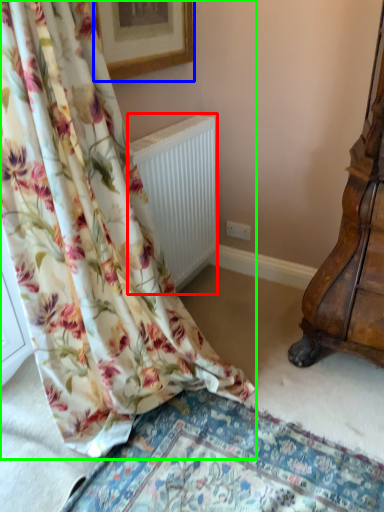
Question: Which object is the farthest from radiator (highlighted by a red box)? Choose among these: picture frame (highlighted by a blue box) or curtain (highlighted by a green box).

Choices:
 (A) picture frame
 (B) curtain

Answer: (B)